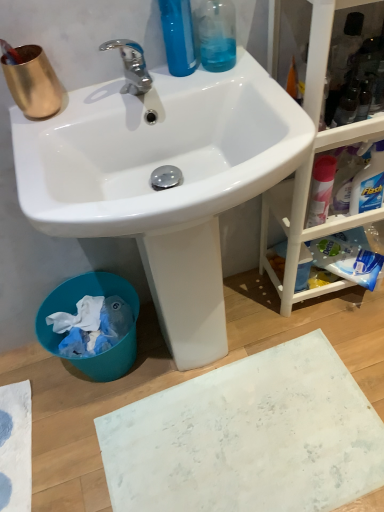
Image resolution: width=384 pixels, height=512 pixels. Describe the element at coordinates (167, 189) in the screenshot. I see `white glossy sink at upper center` at that location.

Describe the element at coordinates (78, 298) in the screenshot. I see `blue plastic trash bin at lower left` at that location.

The width and height of the screenshot is (384, 512). I want to click on blue plastic trash bin at lower left, so click(78, 298).

Locate an element on the screen. Image resolution: width=384 pixels, height=512 pixels. transparent plastic bottle at upper center is located at coordinates (217, 35).

This screenshot has width=384, height=512. What do you see at coordinates (305, 212) in the screenshot?
I see `white wood cabinet at right` at bounding box center [305, 212].

The image size is (384, 512). Describe the element at coordinates (33, 82) in the screenshot. I see `gold metallic cup at upper left` at that location.

Identify the location of white glossy sink at upper center. (167, 189).

From a real-world perspective, who is located lower, white matte bath mat at lower center or white wood cabinet at right?

white matte bath mat at lower center, from a real-world perspective.

Between white matte bath mat at lower center and white wood cabinet at right, which one is positioned in front?

white wood cabinet at right is in front.

Can you confirm if white matte bath mat at lower center is positioned to the right of white wood cabinet at right?

In fact, white matte bath mat at lower center is to the left of white wood cabinet at right.

From the image's perspective, is white matte bath mat at lower center located above white wood cabinet at right?

No, from the image's perspective, white matte bath mat at lower center is not above white wood cabinet at right.

Is chrome metallic faucet at upper center shorter than pink matte spray can at right?

Yes.

Does chrome metallic faucet at upper center touch pink matte spray can at right?

No, chrome metallic faucet at upper center is not making contact with pink matte spray can at right.

Does chrome metallic faucet at upper center come behind pink matte spray can at right?

No, chrome metallic faucet at upper center is in front of pink matte spray can at right.

Can we say white glossy sink at upper center lies outside pink matte spray can at right?

white glossy sink at upper center is positioned outside pink matte spray can at right.

Is white glossy sink at upper center aimed at pink matte spray can at right?

No, white glossy sink at upper center is not oriented towards pink matte spray can at right.

Can you confirm if white glossy sink at upper center is positioned to the left of pink matte spray can at right?

Indeed, white glossy sink at upper center is positioned on the left side of pink matte spray can at right.

In terms of height, does white glossy sink at upper center look taller or shorter compared to pink matte spray can at right?

Clearly, white glossy sink at upper center is taller compared to pink matte spray can at right.

The image size is (384, 512). In order to click on coffee cup on the left of pink matte spray can at right in this screenshot , I will do `click(33, 82)`.

Is gold metallic cup at upper left far from pink matte spray can at right?

No, gold metallic cup at upper left is not far away from pink matte spray can at right.

From the image's perspective, which is above, gold metallic cup at upper left or pink matte spray can at right?

gold metallic cup at upper left, from the image's perspective.

Measure the distance from gold metallic cup at upper left to pink matte spray can at right.

gold metallic cup at upper left is 25.48 inches away from pink matte spray can at right.

Is gold metallic cup at upper left aimed at white glossy sink at upper center?

No, gold metallic cup at upper left is not aimed at white glossy sink at upper center.

Is gold metallic cup at upper left not near white glossy sink at upper center?

No, gold metallic cup at upper left is not far away from white glossy sink at upper center.

Which of these two, gold metallic cup at upper left or white glossy sink at upper center, is smaller?

gold metallic cup at upper left.

Which object is positioned more to the right, gold metallic cup at upper left or white wood cabinet at right?

Positioned to the right is white wood cabinet at right.

Is point (7, 66) positioned after point (350, 130)?

No.

Considering the relative sizes of gold metallic cup at upper left and white wood cabinet at right in the image provided, is gold metallic cup at upper left taller than white wood cabinet at right?

In fact, gold metallic cup at upper left may be shorter than white wood cabinet at right.

From the image's perspective, is gold metallic cup at upper left on top of white wood cabinet at right?

Yes.

In the scene shown: Is pink matte spray can at right positioned with its back to white wood cabinet at right?

Yes, pink matte spray can at right's orientation is away from white wood cabinet at right.

Does pink matte spray can at right have a lesser height compared to white wood cabinet at right?

Yes.

Is pink matte spray can at right situated inside white wood cabinet at right or outside?

pink matte spray can at right fits inside white wood cabinet at right.

Considering the positions of points (312, 178) and (355, 3), is point (312, 178) closer to camera compared to point (355, 3)?

No.

This screenshot has width=384, height=512. What are the coordinates of `bath mat below the white wood cabinet at right (from a real-world perspective)` in the screenshot? It's located at (248, 437).

At what (x,y) coordinates should I click in order to perform the action: click on tap on the left of pink matte spray can at right. Please return your answer as a coordinate pair (x, y). Image resolution: width=384 pixels, height=512 pixels. Looking at the image, I should click on (131, 65).

Considering their positions, is white glossy sink at upper center positioned closer to white matte bath mat at lower center than gold metallic cup at upper left?

The object closer to white matte bath mat at lower center is white glossy sink at upper center.

Looking at the image, which one is located closer to gold metallic cup at upper left, white matte bath mat at lower center or chrome metallic faucet at upper center?

chrome metallic faucet at upper center is positioned closer to the anchor gold metallic cup at upper left.

Based on their spatial positions, is chrome metallic faucet at upper center or white matte bath mat at lower center closer to white glossy sink at upper center?

Based on the image, chrome metallic faucet at upper center appears to be nearer to white glossy sink at upper center.

Considering their positions, is transparent plastic bottle at upper center positioned further to chrome metallic faucet at upper center than pink matte spray can at right?

Among the two, pink matte spray can at right is located further to chrome metallic faucet at upper center.

From the image, which object appears to be nearer to pink matte spray can at right, white matte bath mat at lower center or transparent plastic bottle at upper center?

Among the two, transparent plastic bottle at upper center is located nearer to pink matte spray can at right.

When comparing their distances from white wood cabinet at right, does gold metallic cup at upper left or white glossy sink at upper center seem closer?

white glossy sink at upper center lies closer to white wood cabinet at right than the other object.

Estimate the real-world distances between objects in this image. Which object is further from white glossy sink at upper center, chrome metallic faucet at upper center or gold metallic cup at upper left?

The object further to white glossy sink at upper center is gold metallic cup at upper left.

Estimate the real-world distances between objects in this image. Which object is further from white matte bath mat at lower center, transparent plastic bottle at upper center or white wood cabinet at right?

Among the two, transparent plastic bottle at upper center is located further to white matte bath mat at lower center.

This screenshot has height=512, width=384. I want to click on cleaning product between transparent plastic bottle at upper center and white glossy sink at upper center in the up-down direction, so click(x=321, y=190).

This screenshot has height=512, width=384. I want to click on sink between chrome metallic faucet at upper center and white wood cabinet at right in the horizontal direction, so click(x=167, y=189).

The width and height of the screenshot is (384, 512). In order to click on tap between gold metallic cup at upper left and white wood cabinet at right from left to right in this screenshot , I will do `click(131, 65)`.

Find the location of `trash bin/can between transparent plastic bottle at upper center and white matte bath mat at lower center vertically`. trash bin/can between transparent plastic bottle at upper center and white matte bath mat at lower center vertically is located at coordinates (78, 298).